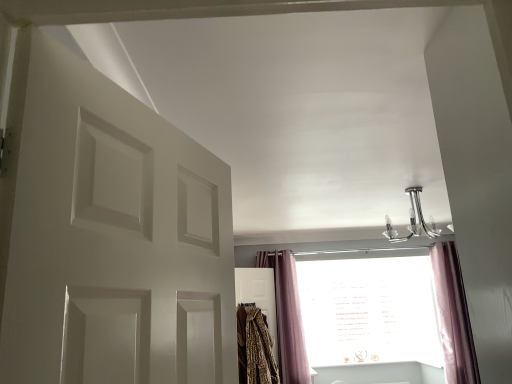
Question: Is leopard print blanket at center with chrome metallic chandelier at upper center?

Choices:
 (A) yes
 (B) no

Answer: (B)

Question: From a real-world perspective, is leopard print blanket at center located beneath chrome metallic chandelier at upper center?

Choices:
 (A) yes
 (B) no

Answer: (A)

Question: Is leopard print blanket at center shorter than chrome metallic chandelier at upper center?

Choices:
 (A) yes
 (B) no

Answer: (B)

Question: Is the position of leopard print blanket at center less distant than that of chrome metallic chandelier at upper center?

Choices:
 (A) yes
 (B) no

Answer: (B)

Question: Is there a large distance between leopard print blanket at center and chrome metallic chandelier at upper center?

Choices:
 (A) yes
 (B) no

Answer: (A)

Question: Considering the relative sizes of leopard print blanket at center and chrome metallic chandelier at upper center in the image provided, is leopard print blanket at center taller than chrome metallic chandelier at upper center?

Choices:
 (A) no
 (B) yes

Answer: (B)

Question: Does pink velvet curtain at lower right, the second curtain from the left, turn towards chrome metallic chandelier at upper center?

Choices:
 (A) no
 (B) yes

Answer: (A)

Question: From a real-world perspective, is pink velvet curtain at lower right, the second curtain from the left, beneath chrome metallic chandelier at upper center?

Choices:
 (A) yes
 (B) no

Answer: (A)

Question: Is pink velvet curtain at lower right, the second curtain from the left, next to chrome metallic chandelier at upper center?

Choices:
 (A) no
 (B) yes

Answer: (A)

Question: Considering the relative sizes of pink velvet curtain at lower right, which appears as the 1th curtain when viewed from the right, and chrome metallic chandelier at upper center in the image provided, is pink velvet curtain at lower right, which appears as the 1th curtain when viewed from the right, bigger than chrome metallic chandelier at upper center?

Choices:
 (A) yes
 (B) no

Answer: (A)

Question: Are pink velvet curtain at lower right, which appears as the 1th curtain when viewed from the right, and chrome metallic chandelier at upper center far apart?

Choices:
 (A) yes
 (B) no

Answer: (A)

Question: Is pink velvet curtain at lower right, the second curtain from the left, further to camera compared to chrome metallic chandelier at upper center?

Choices:
 (A) no
 (B) yes

Answer: (B)

Question: Is chrome metallic chandelier at upper center taller than white matte door at left?

Choices:
 (A) no
 (B) yes

Answer: (A)